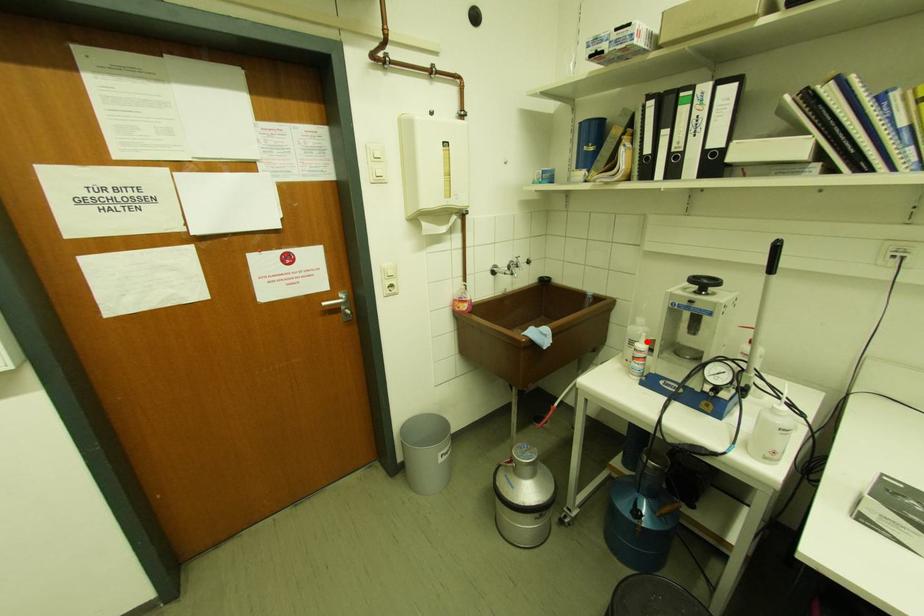
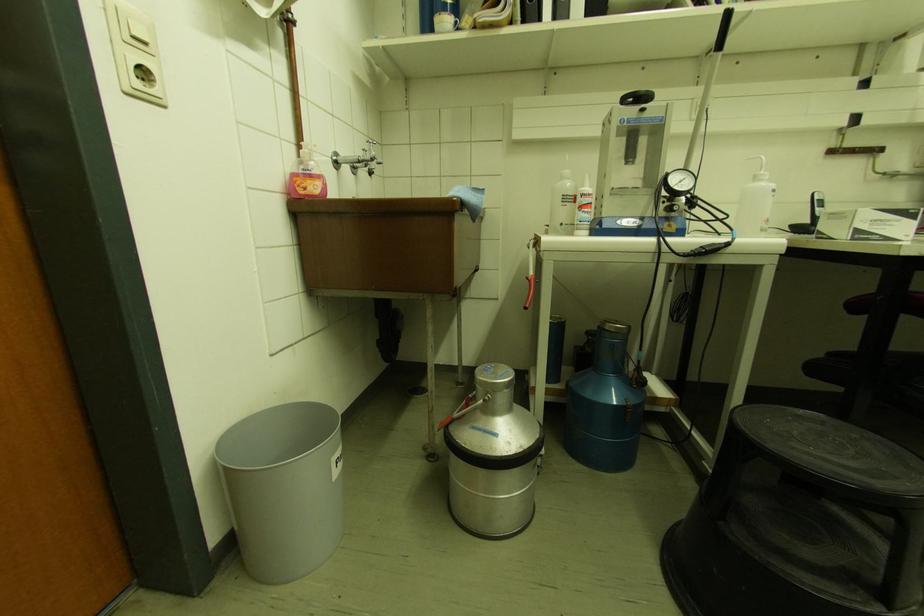
Find the pixel in the second image that matches the highlighted location in the first image.

(590, 185)